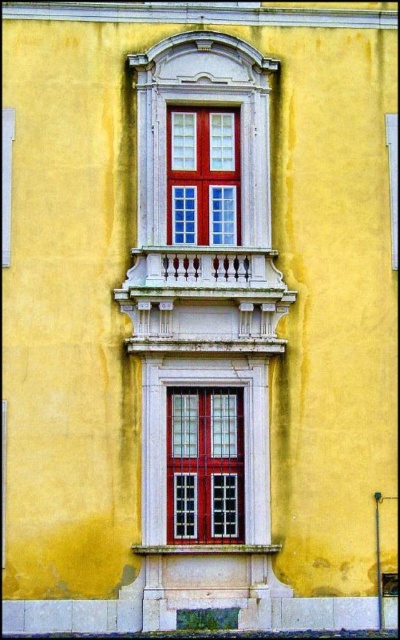
Which is behind, point (252, 397) or point (179, 147)?

The point (179, 147) is behind.

Can you confirm if matte white window frame at center is shorter than matte glass window at center?

In fact, matte white window frame at center may be taller than matte glass window at center.

Who is more forward, (256, 524) or (214, 138)?

Point (256, 524)

Locate an element on the screen. matte white window frame at center is located at coordinates (244, 428).

How far apart are matte red glass window at center and matte glass window at center?

A distance of 11.42 meters exists between matte red glass window at center and matte glass window at center.

Identify the location of matte red glass window at center. Image resolution: width=400 pixels, height=640 pixels. (204, 465).

Does white stone balcony at upper center lie behind matte red glass window at center?

No.

Describe the element at coordinates (204, 300) in the screenshot. I see `white stone balcony at upper center` at that location.

What do you see at coordinates (204, 300) in the screenshot?
I see `white stone balcony at upper center` at bounding box center [204, 300].

I want to click on white stone balcony at upper center, so click(x=204, y=300).